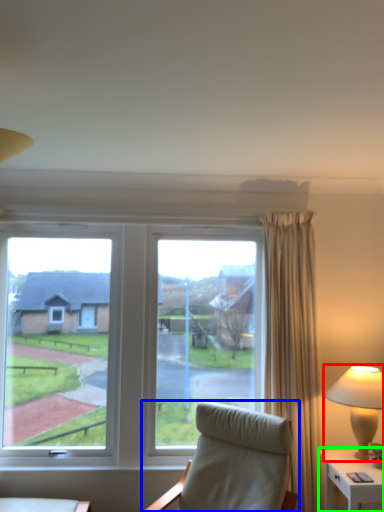
Question: Which is farther away from lamp (highlighted by a red box)? chair (highlighted by a blue box) or nightstand (highlighted by a green box)?

Choices:
 (A) chair
 (B) nightstand

Answer: (A)